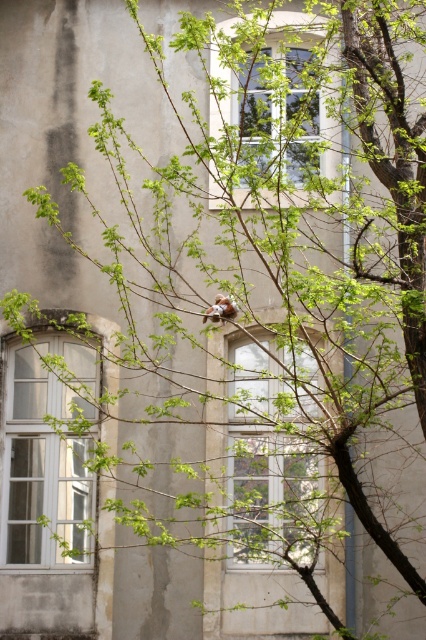
Does point (305, 353) come closer to viewer compared to point (259, 100)?

Yes.

Does clear glass window at center have a lesser height compared to clear glass window at upper center?

Incorrect, clear glass window at center's height does not fall short of clear glass window at upper center's.

Image resolution: width=426 pixels, height=640 pixels. Describe the element at coordinates (273, 456) in the screenshot. I see `clear glass window at center` at that location.

This screenshot has width=426, height=640. Identify the location of clear glass window at center. (273, 456).

Does point (54, 401) come closer to viewer compared to point (302, 102)?

That is False.

Does white glass window at lower left have a larger size compared to clear glass window at upper center?

Indeed, white glass window at lower left has a larger size compared to clear glass window at upper center.

Locate an element on the screen. white glass window at lower left is located at coordinates (46, 456).

Which is more to the left, clear glass window at center or white glass window at lower left?

From the viewer's perspective, white glass window at lower left appears more on the left side.

Looking at this image, between clear glass window at center and white glass window at lower left, which one is positioned higher?

white glass window at lower left is higher up.

Who is more distant from viewer, (259,464) or (57,500)?

The point (57,500) is behind.

Image resolution: width=426 pixels, height=640 pixels. I want to click on clear glass window at center, so click(x=273, y=456).